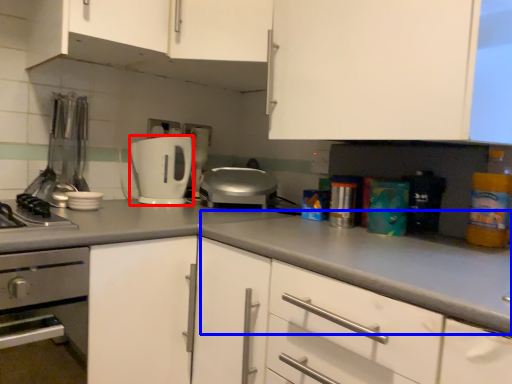
Question: Among these objects, which one is farthest to the camera, toaster (highlighted by a red box) or counter top (highlighted by a blue box)?

Choices:
 (A) toaster
 (B) counter top

Answer: (A)